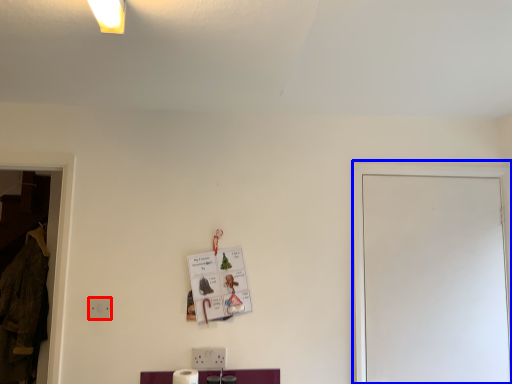
Question: Which object is closer to the camera taking this photo, electric outlet (highlighted by a red box) or glass door (highlighted by a blue box)?

Choices:
 (A) electric outlet
 (B) glass door

Answer: (A)